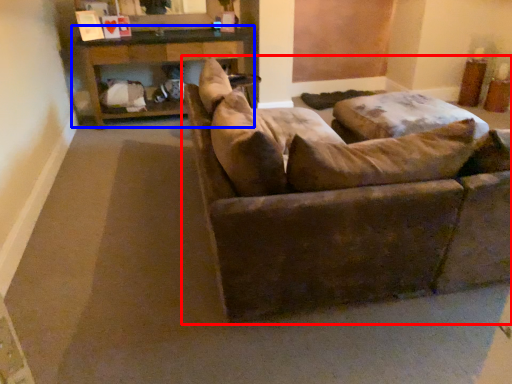
Question: Which object is further to the camera taking this photo, studio couch (highlighted by a red box) or table (highlighted by a blue box)?

Choices:
 (A) studio couch
 (B) table

Answer: (B)